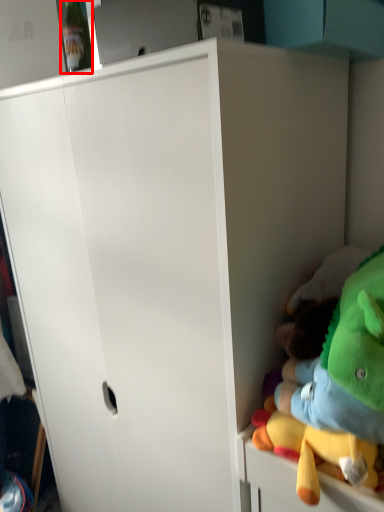
Question: From the image's perspective, considering the relative positions of bottle (annotated by the red box) and toy in the image provided, where is bottle (annotated by the red box) located with respect to the staircase?

Choices:
 (A) above
 (B) below

Answer: (A)